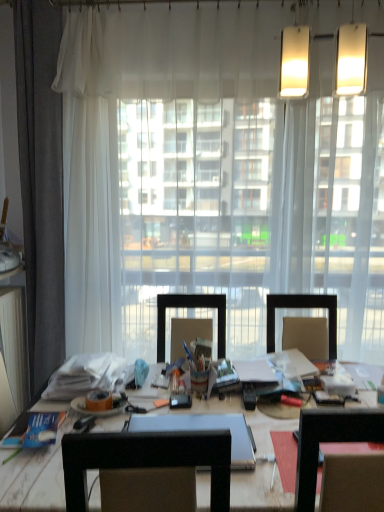
Find the location of a particular element. The width and height of the screenshot is (384, 512). free spot behind blue paper book at lower left is located at coordinates (51, 405).